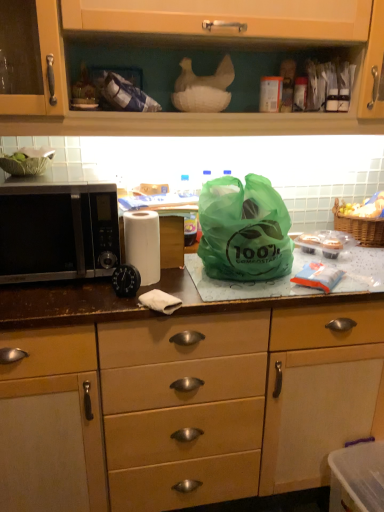
Question: Is matte brown cabinet at center, which is the 2th cabinetry from top to bottom, not inside green translucent bag at center?

Choices:
 (A) yes
 (B) no

Answer: (A)

Question: Considering the relative sizes of matte brown cabinet at center, acting as the first cabinetry starting from the bottom, and green translucent bag at center in the image provided, is matte brown cabinet at center, acting as the first cabinetry starting from the bottom, shorter than green translucent bag at center?

Choices:
 (A) yes
 (B) no

Answer: (B)

Question: From the image's perspective, does matte brown cabinet at center, acting as the first cabinetry starting from the bottom, appear higher than green translucent bag at center?

Choices:
 (A) yes
 (B) no

Answer: (B)

Question: From a real-world perspective, is matte brown cabinet at center, which is the 2th cabinetry from top to bottom, located beneath green translucent bag at center?

Choices:
 (A) no
 (B) yes

Answer: (B)

Question: Is matte brown cabinet at center, acting as the first cabinetry starting from the bottom, closer to camera compared to green translucent bag at center?

Choices:
 (A) yes
 (B) no

Answer: (A)

Question: Could matte brown cabinet at center, acting as the first cabinetry starting from the bottom, be considered to be inside white matte paper towel at center?

Choices:
 (A) yes
 (B) no

Answer: (B)

Question: Is white matte paper towel at center far from matte brown cabinet at center, which is the 2th cabinetry from top to bottom?

Choices:
 (A) yes
 (B) no

Answer: (B)

Question: Does white matte paper towel at center lie behind matte brown cabinet at center, which is the 2th cabinetry from top to bottom?

Choices:
 (A) no
 (B) yes

Answer: (B)

Question: Is white matte paper towel at center at the left side of matte brown cabinet at center, acting as the first cabinetry starting from the bottom?

Choices:
 (A) no
 (B) yes

Answer: (B)

Question: Can you confirm if white matte paper towel at center is shorter than matte brown cabinet at center, which is the 2th cabinetry from top to bottom?

Choices:
 (A) yes
 (B) no

Answer: (A)

Question: From a real-world perspective, is white matte paper towel at center below matte brown cabinet at center, which is the 2th cabinetry from top to bottom?

Choices:
 (A) no
 (B) yes

Answer: (A)

Question: Is black matte microwave at left looking in the opposite direction of matte wood cabinet at upper center, positioned as the 1th cabinetry in top-to-bottom order?

Choices:
 (A) no
 (B) yes

Answer: (A)